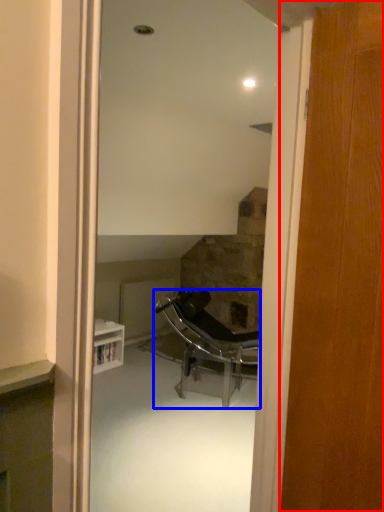
Question: Which of the following is the farthest to the observer, door (highlighted by a red box) or chair (highlighted by a blue box)?

Choices:
 (A) door
 (B) chair

Answer: (B)